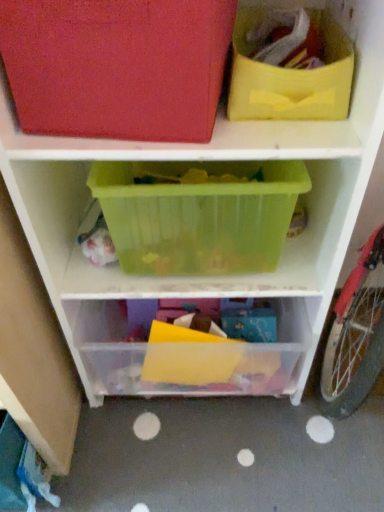
Question: Considering the relative sizes of translucent plastic container at center, which appears as the 2th shelf when viewed from the top, and matte red storage bin at upper left, positioned as the third shelf in bottom-to-top order, in the image provided, is translucent plastic container at center, which appears as the 2th shelf when viewed from the top, bigger than matte red storage bin at upper left, positioned as the third shelf in bottom-to-top order,?

Choices:
 (A) no
 (B) yes

Answer: (B)

Question: Is translucent plastic container at center, which appears as the 2th shelf when viewed from the top, behind matte red storage bin at upper left, positioned as the third shelf in bottom-to-top order?

Choices:
 (A) no
 (B) yes

Answer: (B)

Question: Is translucent plastic container at center, which appears as the 2th shelf when viewed from the top, wider than matte red storage bin at upper left, the 1th shelf when ordered from top to bottom?

Choices:
 (A) no
 (B) yes

Answer: (B)

Question: Is translucent plastic container at center, the second shelf in the bottom-to-top sequence, far from matte red storage bin at upper left, the 1th shelf when ordered from top to bottom?

Choices:
 (A) yes
 (B) no

Answer: (B)

Question: Could matte red storage bin at upper left, positioned as the third shelf in bottom-to-top order, be considered to be inside translucent plastic container at center, which appears as the 2th shelf when viewed from the top?

Choices:
 (A) yes
 (B) no

Answer: (B)

Question: From the image's perspective, is translucent plastic container at center, which appears as the 2th shelf when viewed from the top, located above matte red storage bin at upper left, positioned as the third shelf in bottom-to-top order?

Choices:
 (A) no
 (B) yes

Answer: (A)

Question: Is matte red storage bin at upper left, positioned as the third shelf in bottom-to-top order, further to the viewer compared to translucent plastic container at center, the second shelf in the bottom-to-top sequence?

Choices:
 (A) yes
 (B) no

Answer: (B)

Question: Is matte red storage bin at upper left, positioned as the third shelf in bottom-to-top order, oriented towards translucent plastic container at center, the second shelf in the bottom-to-top sequence?

Choices:
 (A) yes
 (B) no

Answer: (B)

Question: Are matte red storage bin at upper left, positioned as the third shelf in bottom-to-top order, and translucent plastic container at center, which appears as the 2th shelf when viewed from the top, making contact?

Choices:
 (A) yes
 (B) no

Answer: (B)

Question: Does matte red storage bin at upper left, the 1th shelf when ordered from top to bottom, have a smaller size compared to translucent plastic container at center, the second shelf in the bottom-to-top sequence?

Choices:
 (A) yes
 (B) no

Answer: (A)

Question: Does matte red storage bin at upper left, the 1th shelf when ordered from top to bottom, have a greater height compared to translucent plastic container at center, which appears as the 2th shelf when viewed from the top?

Choices:
 (A) yes
 (B) no

Answer: (B)

Question: Is matte red storage bin at upper left, positioned as the third shelf in bottom-to-top order, closer to the viewer compared to translucent plastic container at center, the second shelf in the bottom-to-top sequence?

Choices:
 (A) no
 (B) yes

Answer: (B)

Question: From a real-world perspective, is transparent plastic container at center, placed as the first shelf when sorted from bottom to top, over translucent plastic container at center, the second shelf in the bottom-to-top sequence?

Choices:
 (A) yes
 (B) no

Answer: (B)